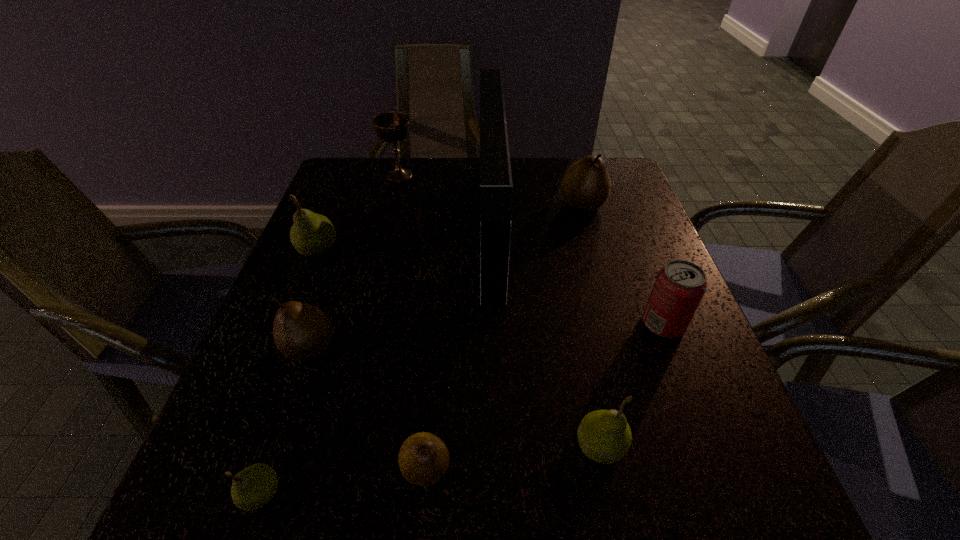
At what (x,y) coordinates should I click in order to perform the action: click on blank area in the image that satisfies the following two spatial constraints: 1. on the back side of the nearest green pear; 2. on the right side of the second smallest green pear. Please return your answer as a coordinate pair (x, y). Image resolution: width=960 pixels, height=540 pixels. Looking at the image, I should click on (277, 446).

Image resolution: width=960 pixels, height=540 pixels. Identify the location of free region that satisfies the following two spatial constraints: 1. on the front side of the second biggest green pear; 2. on the right side of the chalice. (332, 446).

Locate an element on the screen. The width and height of the screenshot is (960, 540). free point that satisfies the following two spatial constraints: 1. on the front side of the second farthest green pear; 2. on the right side of the black videotape is located at coordinates (497, 446).